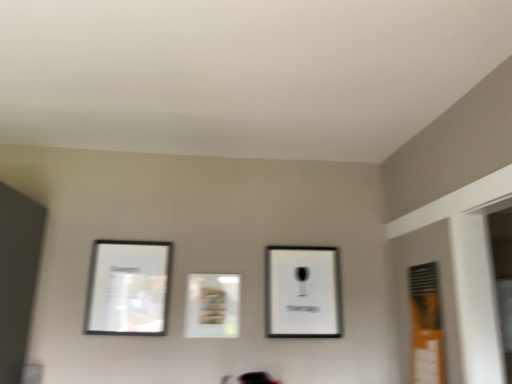
Question: Should I look upward or downward to see matte white picture frame at center, which ranks as the second picture frame in right-to-left order?

Choices:
 (A) up
 (B) down

Answer: (B)

Question: Is orange matte window at right taller than matte white picture frame at center, which is counted as the 2th picture frame, starting from the left?

Choices:
 (A) yes
 (B) no

Answer: (A)

Question: Can you confirm if orange matte window at right is positioned to the left of matte white picture frame at center, which is counted as the 2th picture frame, starting from the left?

Choices:
 (A) no
 (B) yes

Answer: (A)

Question: Considering the relative sizes of orange matte window at right and matte white picture frame at center, which ranks as the second picture frame in right-to-left order, in the image provided, is orange matte window at right thinner than matte white picture frame at center, which ranks as the second picture frame in right-to-left order,?

Choices:
 (A) yes
 (B) no

Answer: (B)

Question: Does orange matte window at right lie behind matte white picture frame at center, which ranks as the second picture frame in right-to-left order?

Choices:
 (A) yes
 (B) no

Answer: (B)

Question: From a real-world perspective, is orange matte window at right located beneath matte white picture frame at center, which is counted as the 2th picture frame, starting from the left?

Choices:
 (A) no
 (B) yes

Answer: (B)

Question: Does orange matte window at right have a smaller size compared to matte white picture frame at center, which is counted as the 2th picture frame, starting from the left?

Choices:
 (A) yes
 (B) no

Answer: (B)

Question: Would you consider matte white picture frame at center, which ranks as the second picture frame in right-to-left order, to be distant from black matte picture frame at upper center, positioned as the first picture frame in right-to-left order?

Choices:
 (A) no
 (B) yes

Answer: (A)

Question: From the image's perspective, is matte white picture frame at center, which is counted as the 2th picture frame, starting from the left, below black matte picture frame at upper center, positioned as the first picture frame in right-to-left order?

Choices:
 (A) yes
 (B) no

Answer: (A)

Question: From the image's perspective, is matte white picture frame at center, which is counted as the 2th picture frame, starting from the left, located above black matte picture frame at upper center, which is the third picture frame from left to right?

Choices:
 (A) yes
 (B) no

Answer: (B)

Question: Can you confirm if matte white picture frame at center, which is counted as the 2th picture frame, starting from the left, is positioned to the right of black matte picture frame at upper center, positioned as the first picture frame in right-to-left order?

Choices:
 (A) yes
 (B) no

Answer: (B)

Question: From a real-world perspective, does matte white picture frame at center, which ranks as the second picture frame in right-to-left order, sit lower than black matte picture frame at upper center, positioned as the first picture frame in right-to-left order?

Choices:
 (A) yes
 (B) no

Answer: (A)

Question: Is matte white picture frame at center, which is counted as the 2th picture frame, starting from the left, thinner than black matte picture frame at upper center, which is the third picture frame from left to right?

Choices:
 (A) yes
 (B) no

Answer: (A)

Question: Does matte black picture frame at left, marked as the 1th picture frame in a left-to-right arrangement, have a lesser width compared to black matte picture frame at upper center, which is the third picture frame from left to right?

Choices:
 (A) yes
 (B) no

Answer: (A)